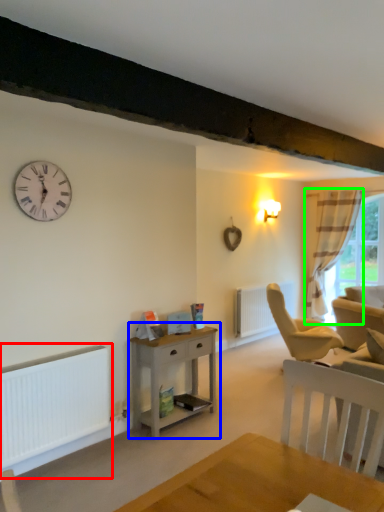
Question: Which object is positioned farthest from heater (highlighted by a red box)? Select from nightstand (highlighted by a blue box) and curtain (highlighted by a green box).

Choices:
 (A) nightstand
 (B) curtain

Answer: (B)